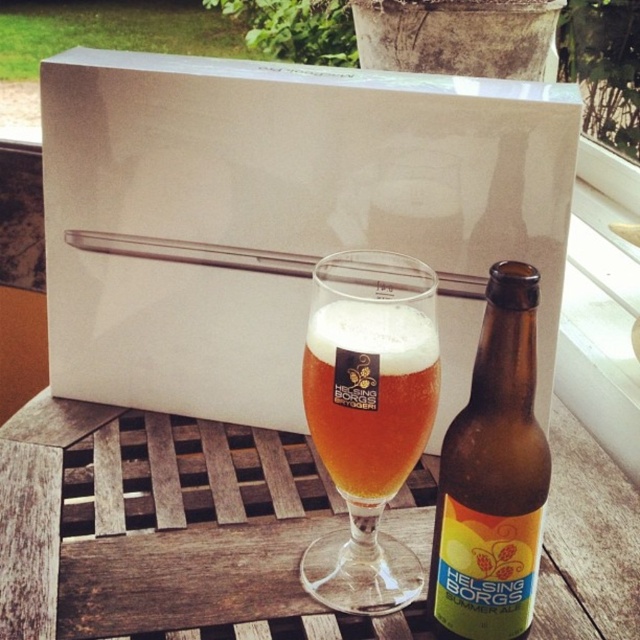
You are standing at the edge of the patio and want to place a small potted plant on the wooden slatted table at center. Given that the table is at point [163,529], can you confirm if this location is suitable for placing the plant?

The wooden slatted table at center is located at point [163,529], so yes, placing the small potted plant there would be suitable as the table is the correct location.

You are organizing a picnic and need to know if the brown glass bottle at center can fit on the wooden slatted table at center. Based on their sizes, can it fit?

The wooden slatted table at center is larger in size than the brown glass bottle at center, so the bottle can fit on the table.